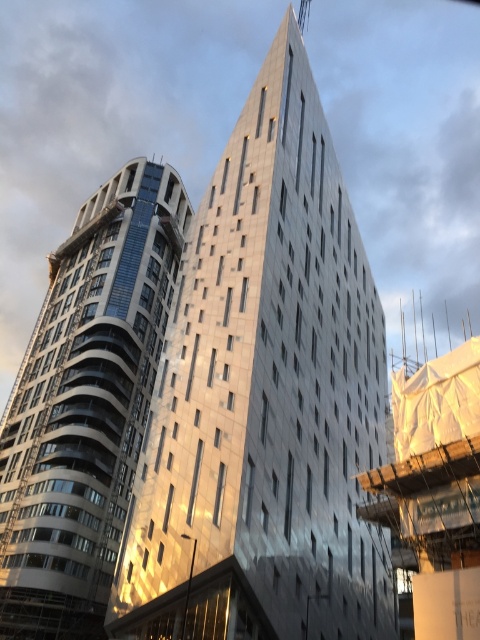
You are a construction worker standing at the base of the left curved building. You notice two points marked on the right angular building. The first point is at coordinates point [280,580] and the second is at point [23,481]. Which point is nearer to your current position?

The point [280,580] is closer to the camera than point [23,481], so the first point is nearer to your current position.

Based on the photo, you are an architect evaluating the construction site. You need to determine which building, the metallic silver building at center or the metallic glass tower at left, requires more materials for its roof. Based on the information provided, which one would you prioritize for material allocation?

The metallic silver building at center is taller than the metallic glass tower at left, so it likely has a larger roof area requiring more materials. Prioritize the metallic silver building at center for material allocation.